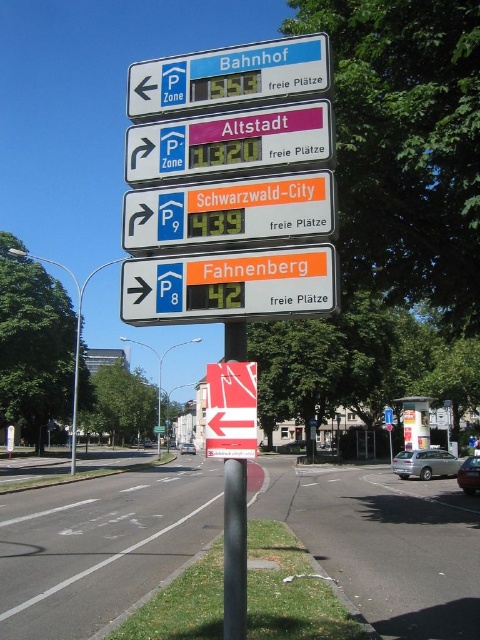
You are standing in front of the traffic signboard and want to take a photo of the two points labeled point (301, 266) and point (277, 40). Which point should you focus on first to ensure both are in sharp focus?

You should focus on point (301, 266) first because it is closer to the camera than point (277, 40). By focusing on the closer point, the farther point will also be within the depth of field and in focus.

What is the color of the object at point (229, 285)?

The object at point (229, 285) is orange plastic parking sign at lower center.